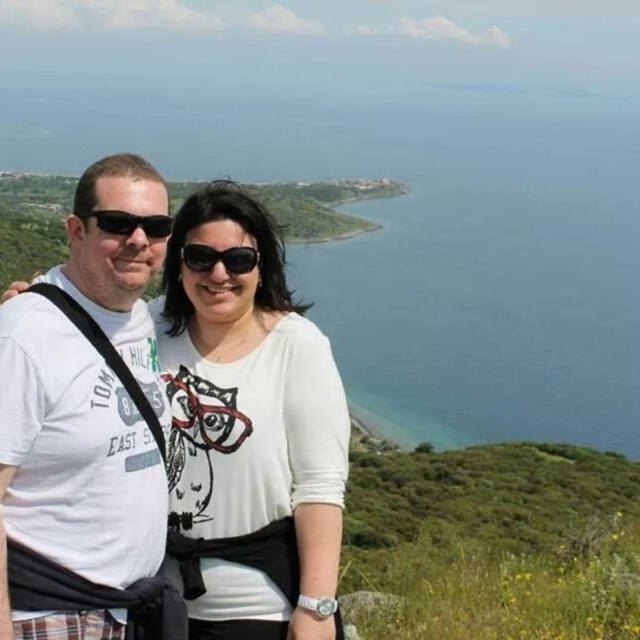
Does white matte shirt at center appear under black plastic sunglasses at center?

Indeed, white matte shirt at center is positioned under black plastic sunglasses at center.

Does white matte shirt at center have a greater width compared to black plastic sunglasses at center?

Yes, white matte shirt at center is wider than black plastic sunglasses at center.

Describe the element at coordinates (250, 428) in the screenshot. The image size is (640, 640). I see `white matte shirt at center` at that location.

The width and height of the screenshot is (640, 640). Find the location of `white matte shirt at center`. white matte shirt at center is located at coordinates (250, 428).

Does white cotton t-shirt at left come in front of black plastic sunglasses at center?

Yes, it is.

Which of these two, white cotton t-shirt at left or black plastic sunglasses at center, stands shorter?

black plastic sunglasses at center

Between point (83, 349) and point (218, 252), which one is positioned behind?

Point (218, 252)

Locate an element on the screen. white cotton t-shirt at left is located at coordinates (72, 468).

Can you confirm if white cotton t-shirt at left is shorter than black plastic sunglasses at left?

No, white cotton t-shirt at left is not shorter than black plastic sunglasses at left.

This screenshot has height=640, width=640. Identify the location of white cotton t-shirt at left. (72, 468).

Who is more forward, (36, 449) or (113, 218)?

Point (36, 449) is in front.

Find the location of a particular element. This screenshot has width=640, height=640. white cotton t-shirt at left is located at coordinates (72, 468).